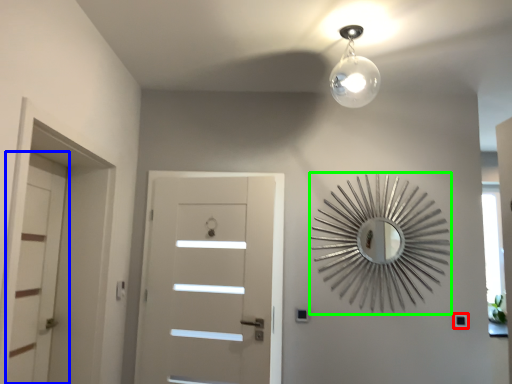
Question: Which object is the closest to the light switch (highlighted by a red box)? Choose among these: door (highlighted by a blue box) or design (highlighted by a green box).

Choices:
 (A) door
 (B) design

Answer: (B)